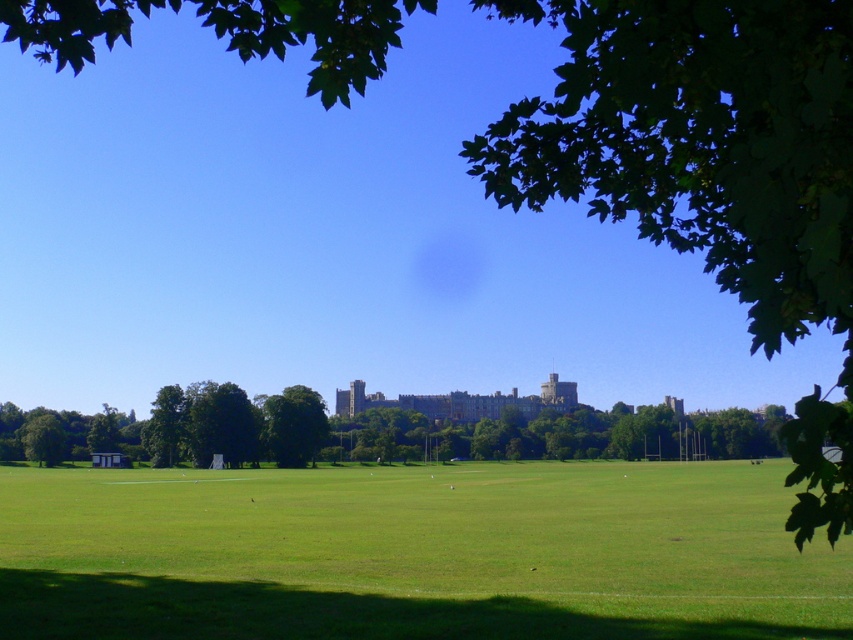
Between green grass field at center and green leafy tree at center, which one appears on the left side from the viewer's perspective?

green leafy tree at center is more to the left.

At what (x,y) coordinates should I click in order to perform the action: click on green grass field at center. Please return your answer as a coordinate pair (x, y). Looking at the image, I should click on (415, 554).